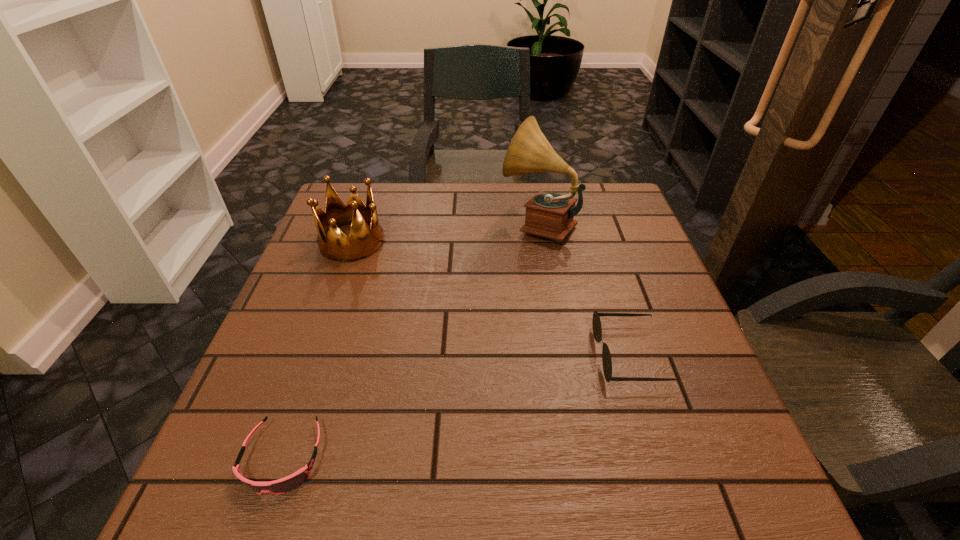
Locate an element on the screen. The height and width of the screenshot is (540, 960). vacant point located between the crown and the goggles is located at coordinates (318, 349).

The width and height of the screenshot is (960, 540). I want to click on vacant space that is in between the phonograph record and the third farthest object, so click(x=584, y=289).

Locate an element on the screen. The image size is (960, 540). blank region between the sunglasses and the phonograph record is located at coordinates (584, 289).

Image resolution: width=960 pixels, height=540 pixels. I want to click on free spot between the crown and the second nearest object, so click(491, 299).

Identify the location of empty location between the sunglasses and the third shortest object. Image resolution: width=960 pixels, height=540 pixels. (491, 299).

Locate an element on the screen. Image resolution: width=960 pixels, height=540 pixels. vacant point located between the sunglasses and the phonograph record is located at coordinates (584, 289).

Where is `vacant area that lies between the sunglasses and the second tallest object`? Image resolution: width=960 pixels, height=540 pixels. vacant area that lies between the sunglasses and the second tallest object is located at coordinates (491, 299).

Identify which object is the second nearest to the goggles. Please provide its 2D coordinates. Your answer should be formatted as a tuple, i.e. [(x, y)], where the tuple contains the x and y coordinates of a point satisfying the conditions above.

[(596, 322)]

Choose which object is the nearest neighbor to the phonograph record. Please provide its 2D coordinates. Your answer should be formatted as a tuple, i.e. [(x, y)], where the tuple contains the x and y coordinates of a point satisfying the conditions above.

[(596, 322)]

I want to click on blank space that satisfies the following two spatial constraints: 1. on the horn of the tallest object; 2. on the front-facing side of the shortest object, so point(578,458).